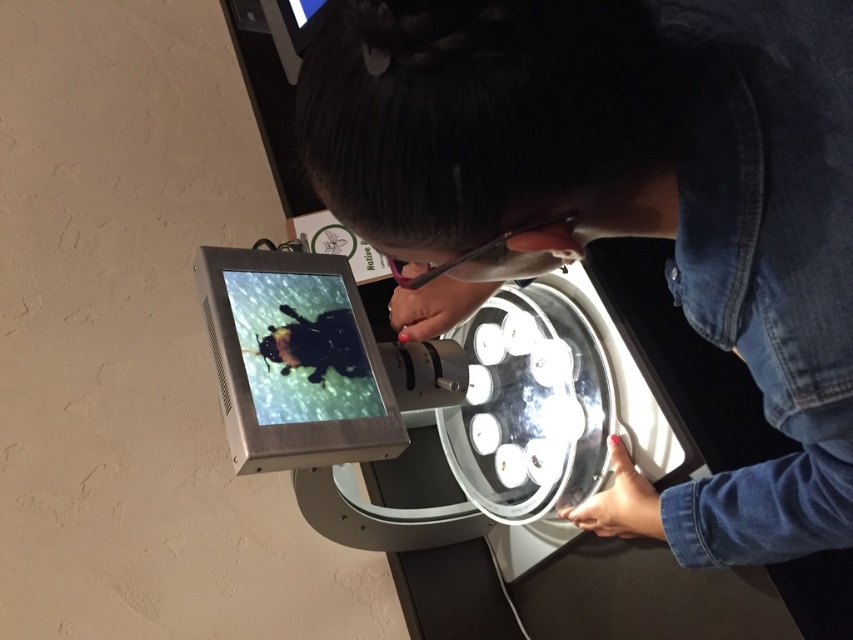
Can you confirm if denim jacket at center is taller than matte black screen at center?

Indeed, denim jacket at center has a greater height compared to matte black screen at center.

Does denim jacket at center appear on the right side of matte black screen at center?

Indeed, denim jacket at center is positioned on the right side of matte black screen at center.

This screenshot has height=640, width=853. I want to click on denim jacket at center, so click(622, 204).